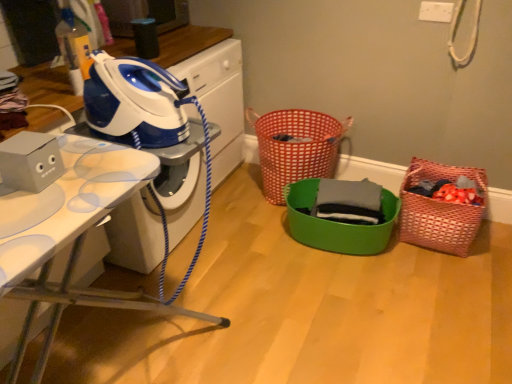
The width and height of the screenshot is (512, 384). I want to click on vacant area in front of woven pink basket at right, positioned as the 1th basket in right-to-left order, so click(454, 276).